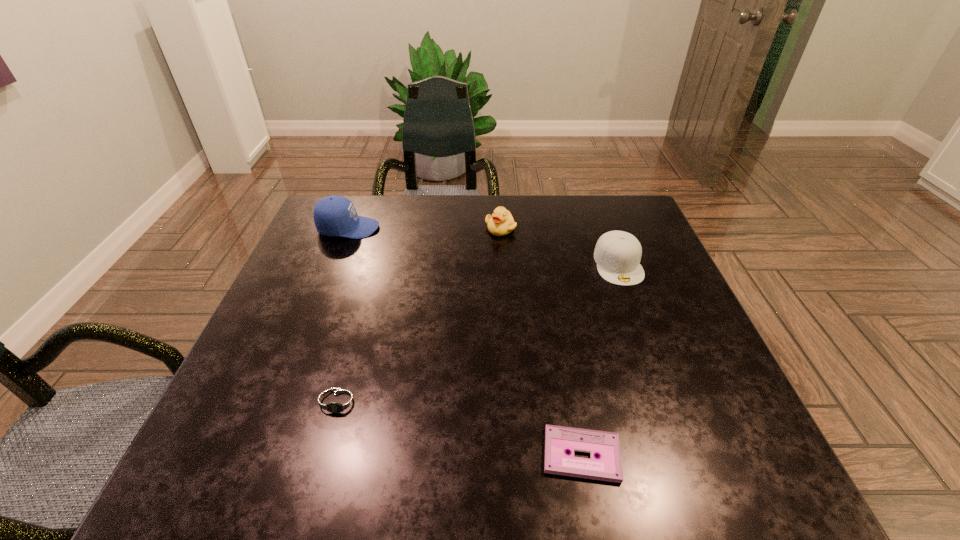
You are a GUI agent. You are given a task and a screenshot of the screen. Output one action in this format:
    pyautogui.click(x=<x>, y=<y>)
    Task: Click on the vacant region that satisfies the following two spatial constraints: 1. on the front-facing side of the tallest object; 2. on the left side of the videotape
    This screenshot has height=540, width=960.
    Given the screenshot: What is the action you would take?
    pyautogui.click(x=260, y=455)

At what (x,y) coordinates should I click in order to perform the action: click on blank space that satisfies the following two spatial constraints: 1. on the front-facing side of the fourth object from left to right; 2. on the left side of the tallest object. Please return your answer as a coordinate pair (x, y). This screenshot has height=540, width=960. Looking at the image, I should click on (260, 455).

The height and width of the screenshot is (540, 960). In order to click on vacant area that satisfies the following two spatial constraints: 1. on the face of the shortest object; 2. on the left side of the fourth tallest object in this screenshot , I will do `click(325, 455)`.

The height and width of the screenshot is (540, 960). I want to click on vacant space that satisfies the following two spatial constraints: 1. on the face of the watch; 2. on the right side of the videotape, so click(x=325, y=455).

Locate an element on the screen. The width and height of the screenshot is (960, 540). vacant point that satisfies the following two spatial constraints: 1. on the face of the shortest object; 2. on the right side of the watch is located at coordinates (325, 455).